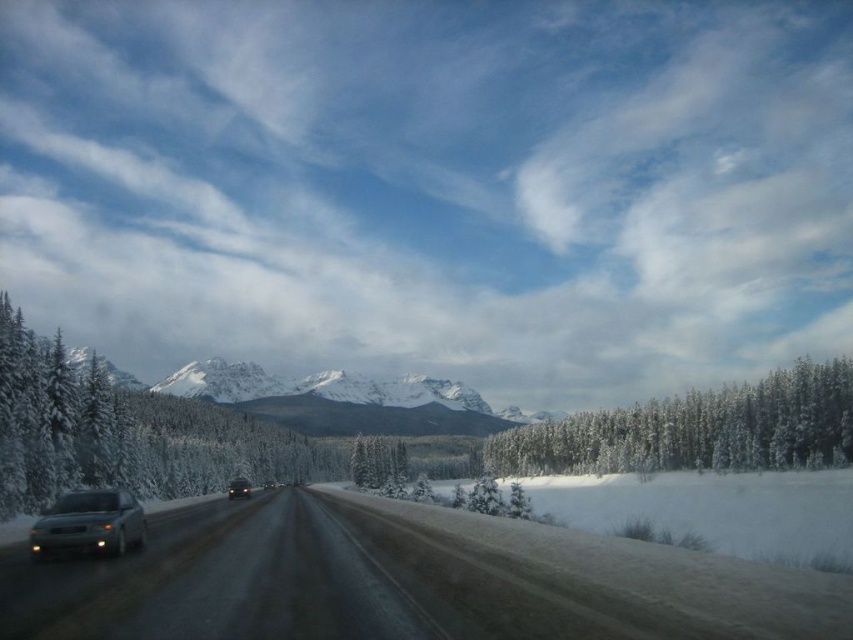
You are driving a matte silver sedan at center and want to take a photo of the snowy granite mountain at center through the windshield. Can you see the entire mountain in your viewfinder?

The snowy granite mountain at center has a greater height compared to matte silver sedan at center, so the mountain is taller than the sedan. Since the sedan is shorter than the mountain, the windshield would allow you to see the entire mountain in the viewfinder as long as there are no obstructions.